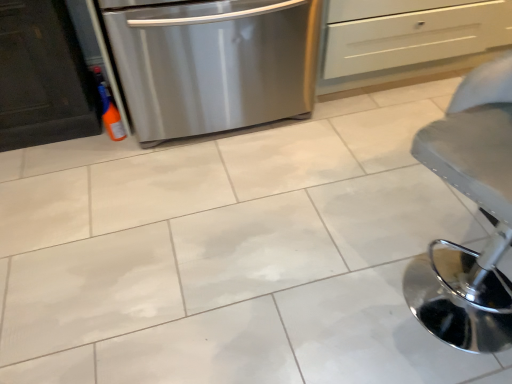
Question: Would you say white matte drawer at upper center is to the left or to the right of stainless steel dishwasher at left in the picture?

Choices:
 (A) left
 (B) right

Answer: (B)

Question: Is white matte drawer at upper center situated inside stainless steel dishwasher at left or outside?

Choices:
 (A) inside
 (B) outside

Answer: (B)

Question: Which is nearer to the metallic gray stool at lower right?

Choices:
 (A) stainless steel dishwasher at left
 (B) white matte drawer at upper center

Answer: (A)

Question: Which object is positioned farthest from the metallic gray stool at lower right?

Choices:
 (A) stainless steel dishwasher at left
 (B) white matte drawer at upper center

Answer: (B)